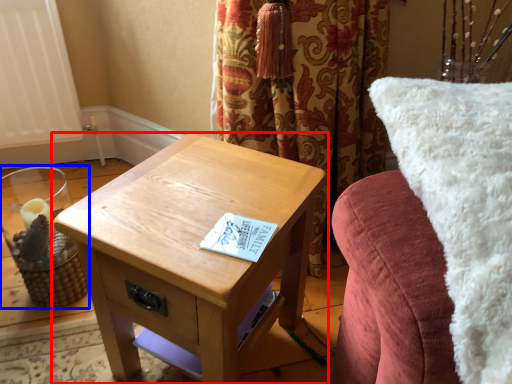
Question: Which object is further to the camera taking this photo, table (highlighted by a red box) or candle holder (highlighted by a blue box)?

Choices:
 (A) table
 (B) candle holder

Answer: (B)